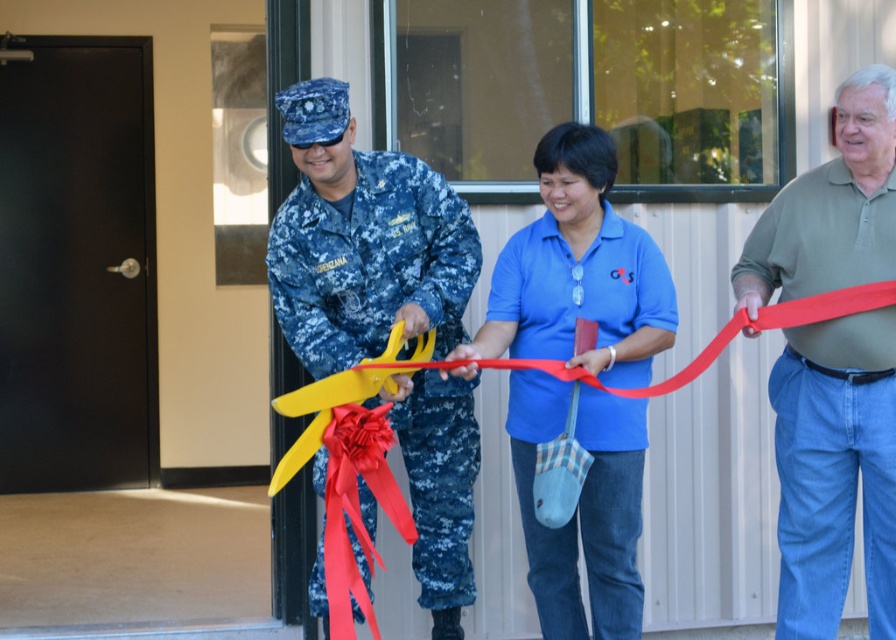
Question: Which object appears closest to the camera in this image?

Choices:
 (A) green cotton polo shirt at right
 (B) digital camouflage uniform at center

Answer: (A)

Question: Can you confirm if digital camouflage uniform at center is positioned above silky red ribbon at center?

Choices:
 (A) no
 (B) yes

Answer: (B)

Question: Which object appears closest to the camera in this image?

Choices:
 (A) silky red ribbon at center
 (B) yellow matte scissors at center
 (C) green cotton polo shirt at right
 (D) blue cotton shirt at center

Answer: (A)

Question: Which point is closer to the camera?

Choices:
 (A) digital camouflage uniform at center
 (B) blue cotton shirt at center
 (C) green cotton polo shirt at right

Answer: (B)

Question: Considering the relative positions of yellow matte scissors at center and green cotton polo shirt at right in the image provided, where is yellow matte scissors at center located with respect to green cotton polo shirt at right?

Choices:
 (A) left
 (B) right

Answer: (A)

Question: Is digital camouflage uniform at center closer to the viewer compared to silky red ribbon at center?

Choices:
 (A) yes
 (B) no

Answer: (B)